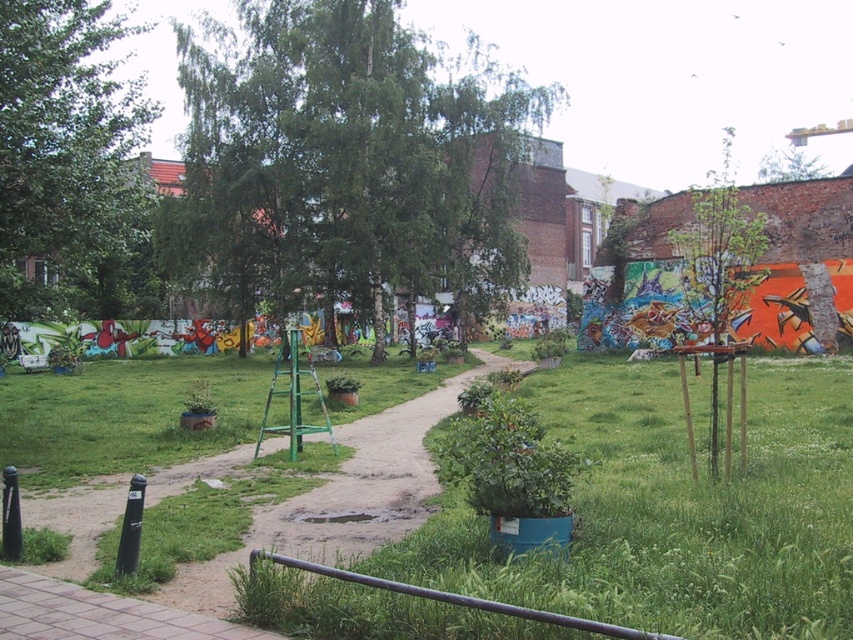
Can you confirm if green leafy tree at upper left is wider than green leafy tree at upper right?

No, green leafy tree at upper left is not wider than green leafy tree at upper right.

Is point (35, 204) behind point (795, 163)?

No.

Where is `green leafy tree at upper left`? The height and width of the screenshot is (640, 853). green leafy tree at upper left is located at coordinates (70, 164).

Does point (497, 156) come behind point (131, 291)?

No.

Is green leafy tree at center to the left of green leafy tree at upper left from the viewer's perspective?

In fact, green leafy tree at center is to the right of green leafy tree at upper left.

Does point (345, 260) come behind point (0, 90)?

Yes, point (345, 260) is behind point (0, 90).

This screenshot has height=640, width=853. Find the location of `green leafy tree at center`. green leafy tree at center is located at coordinates (345, 161).

In the scene shown: Who is positioned more to the right, green leafy tree at center or green leafy tree at upper right?

green leafy tree at upper right is more to the right.

Between green leafy tree at center and green leafy tree at upper right, which one appears on the left side from the viewer's perspective?

From the viewer's perspective, green leafy tree at center appears more on the left side.

Who is more distant from viewer, (271, 234) or (798, 163)?

Point (798, 163)

At what (x,y) coordinates should I click in order to perform the action: click on green leafy tree at center. Please return your answer as a coordinate pair (x, y). This screenshot has width=853, height=640. Looking at the image, I should click on (345, 161).